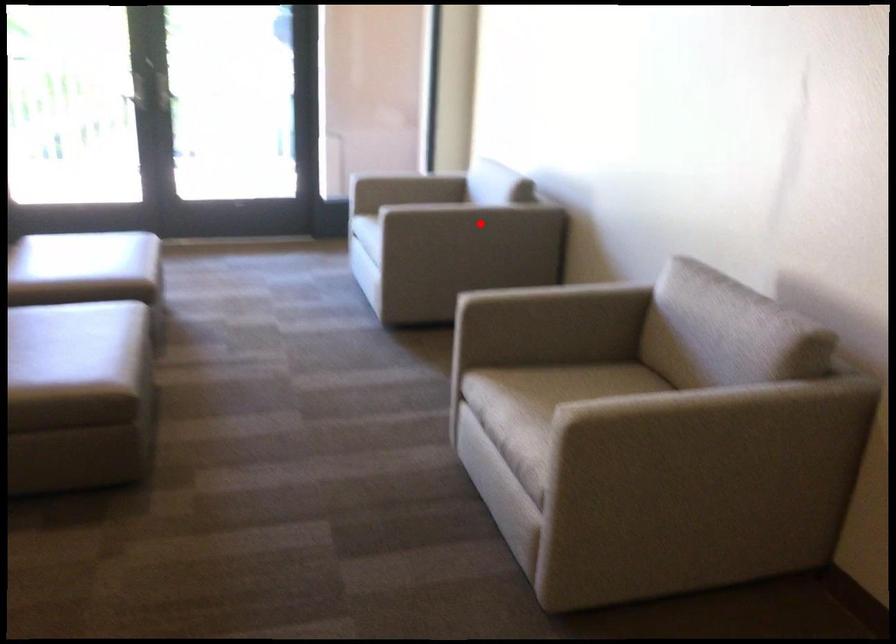
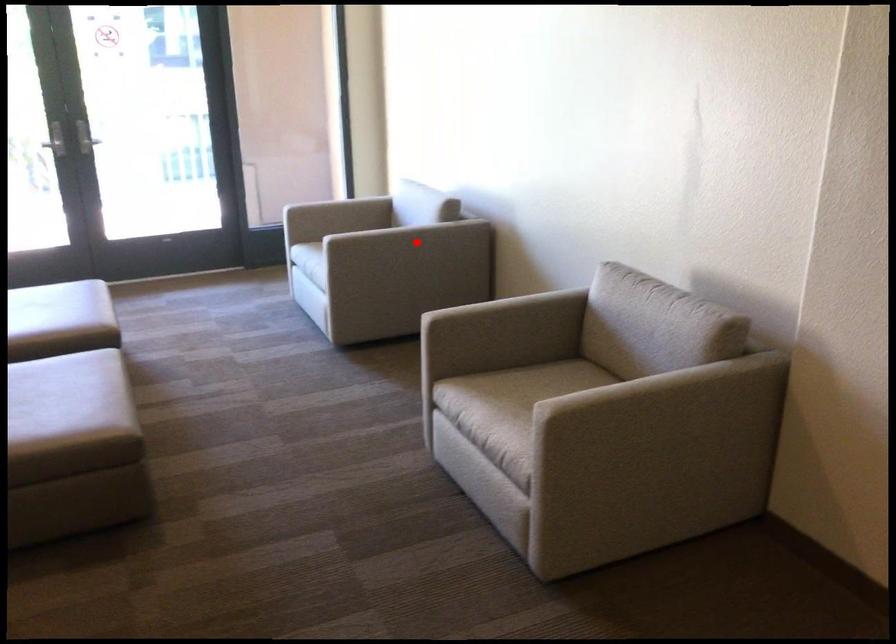
I am providing you with two images of the same scene from different viewpoints. A red point is marked on the first image and another point is marked on the second image. Is the marked point in image1 the same physical position as the marked point in image2?

Yes